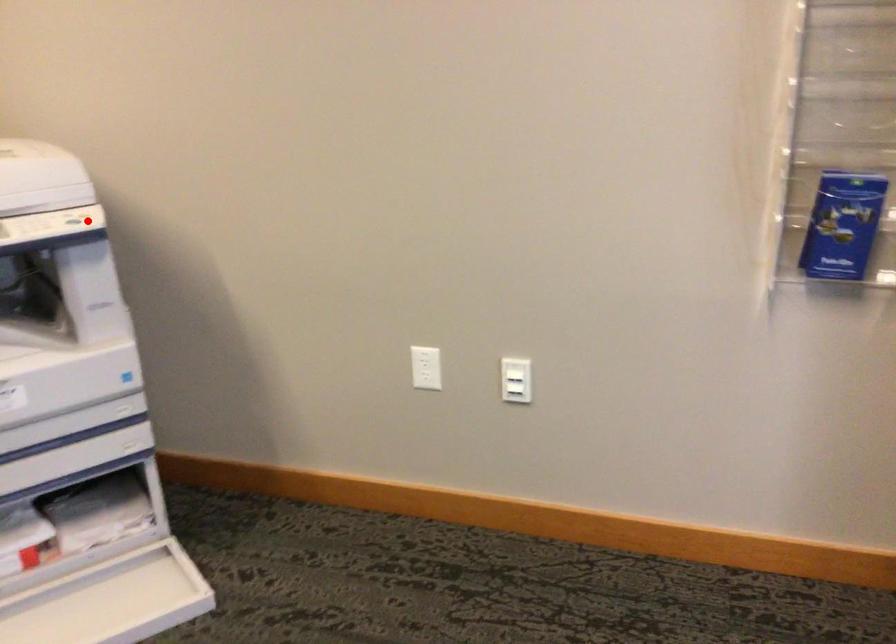
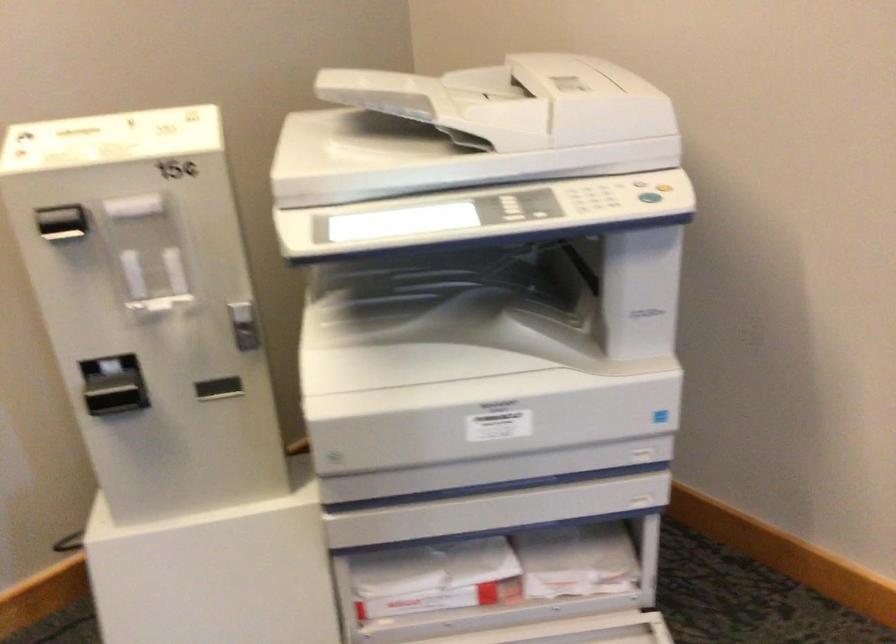
Question: I am providing you with two images of the same scene from different viewpoints. Image1 has a red point marked. In image2, the corresponding 3D location appears at what relative position? Reply with the corresponding letter.

Choices:
 (A) Closer
 (B) Farther

Answer: (A)